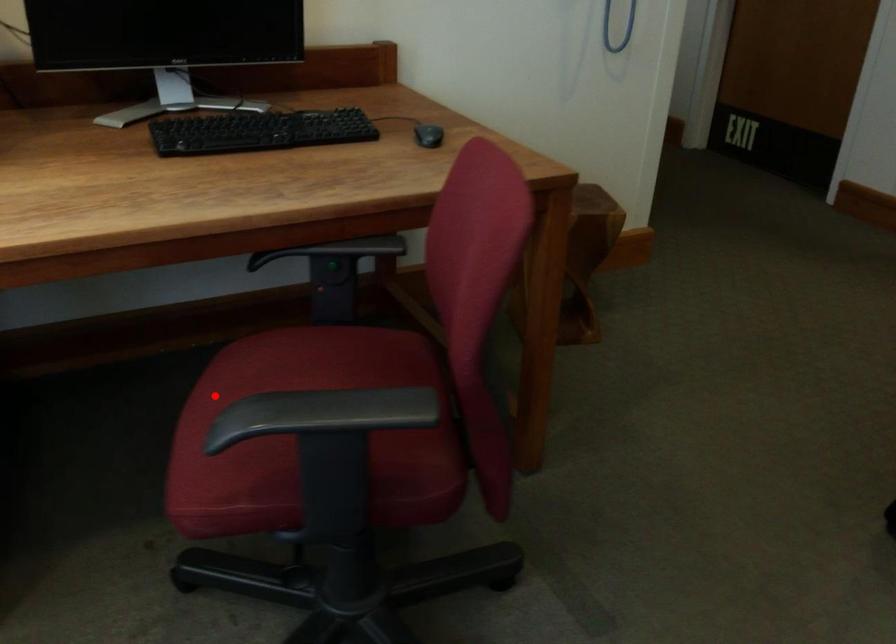
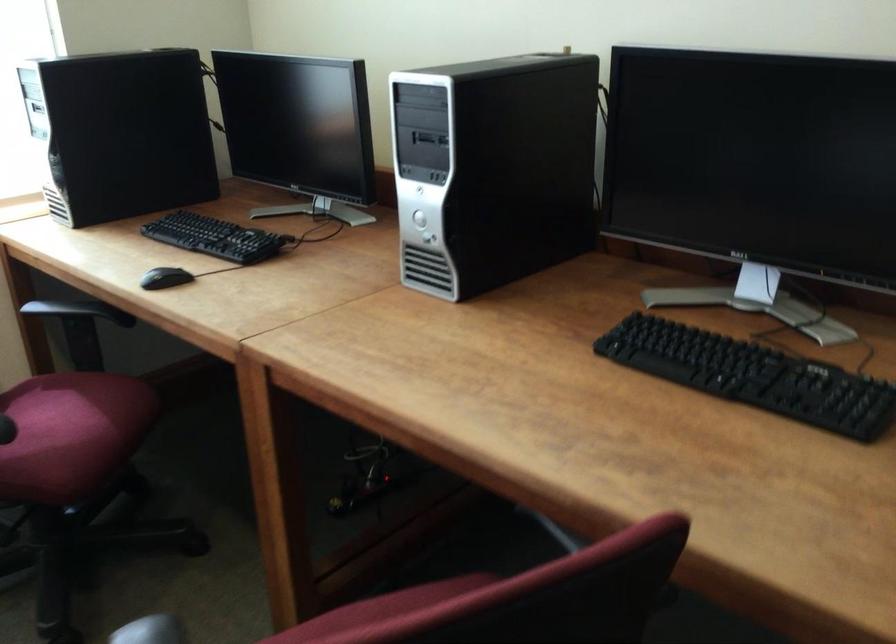
Where in the second image is the point corresponding to the highlighted location from the first image?

(381, 608)